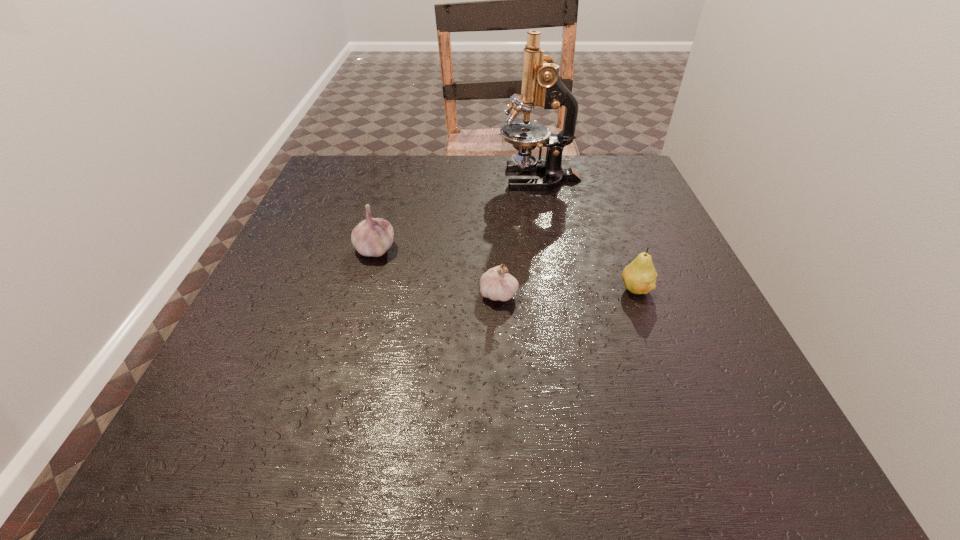
The height and width of the screenshot is (540, 960). I want to click on vacant region between the farthest object and the rightmost object, so (587, 234).

This screenshot has height=540, width=960. In order to click on vacant space in between the leftmost object and the right garlic in this screenshot , I will do `click(437, 271)`.

Locate an element on the screen. free space between the leftmost object and the tallest object is located at coordinates pos(457,213).

You are a GUI agent. You are given a task and a screenshot of the screen. Output one action in this format:
    pyautogui.click(x=<x>, y=<y>)
    Task: Click on the empty location between the shortest object and the microscope
    
    Given the screenshot: What is the action you would take?
    pyautogui.click(x=518, y=236)

What are the coordinates of `vacant region between the nearer garlic and the microscope` in the screenshot? It's located at (518, 236).

This screenshot has height=540, width=960. What are the coordinates of `object identified as the third closest to the shorter garlic` in the screenshot? It's located at (541, 86).

Locate an element on the screen. This screenshot has height=540, width=960. the second closest object to the farther garlic is located at coordinates click(541, 86).

Where is `free space that satisfies the following two spatial constraints: 1. on the front side of the rightmost object; 2. on the right side of the taller garlic`? This screenshot has height=540, width=960. free space that satisfies the following two spatial constraints: 1. on the front side of the rightmost object; 2. on the right side of the taller garlic is located at coordinates (364, 289).

Image resolution: width=960 pixels, height=540 pixels. Identify the location of vacant region that satisfies the following two spatial constraints: 1. at the eyepiece of the pear; 2. on the right side of the microscope. (561, 289).

Identify the location of free space that satisfies the following two spatial constraints: 1. on the front side of the shorter garlic; 2. on the right side of the taller garlic. This screenshot has height=540, width=960. (362, 293).